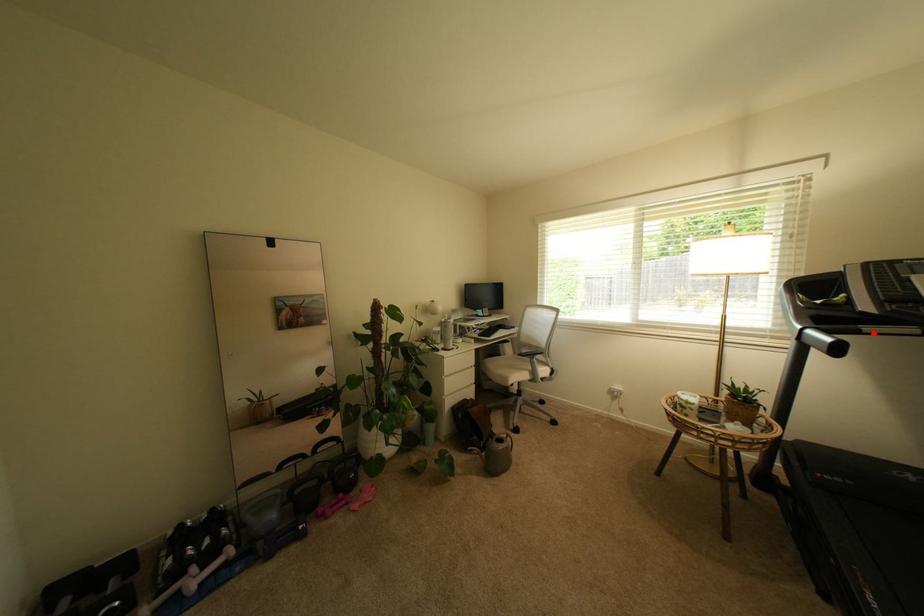
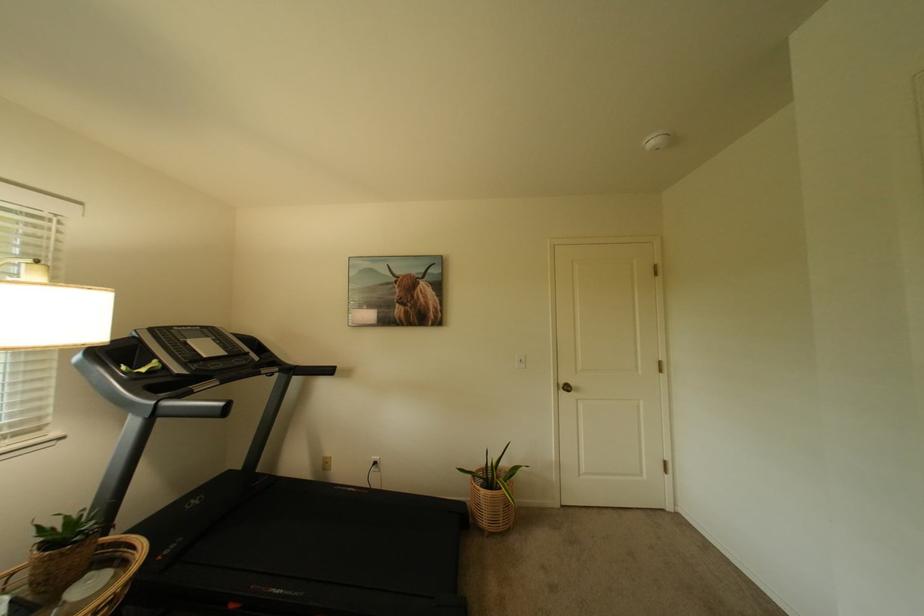
The point at the highlighted location is marked in the first image. Where is the corresponding point in the second image?

(203, 392)